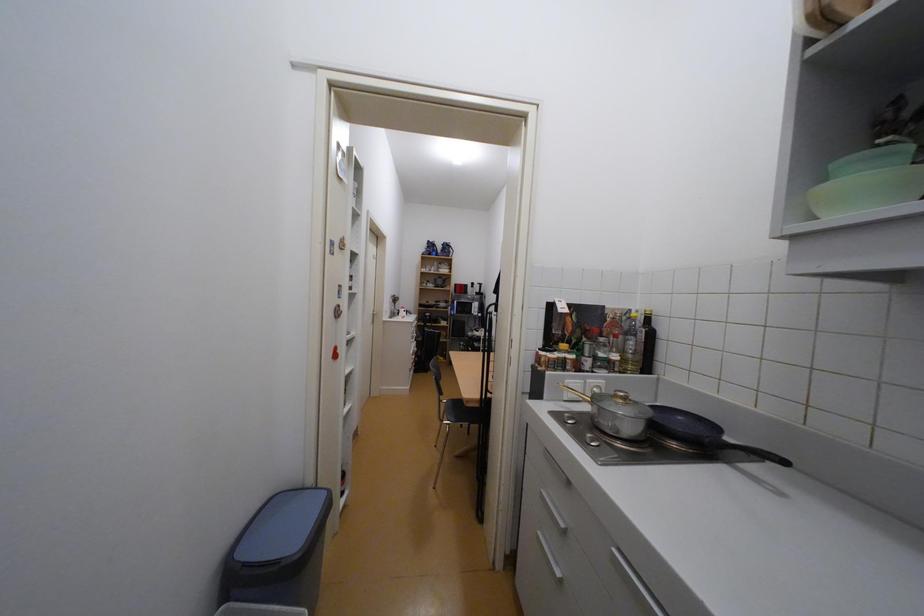
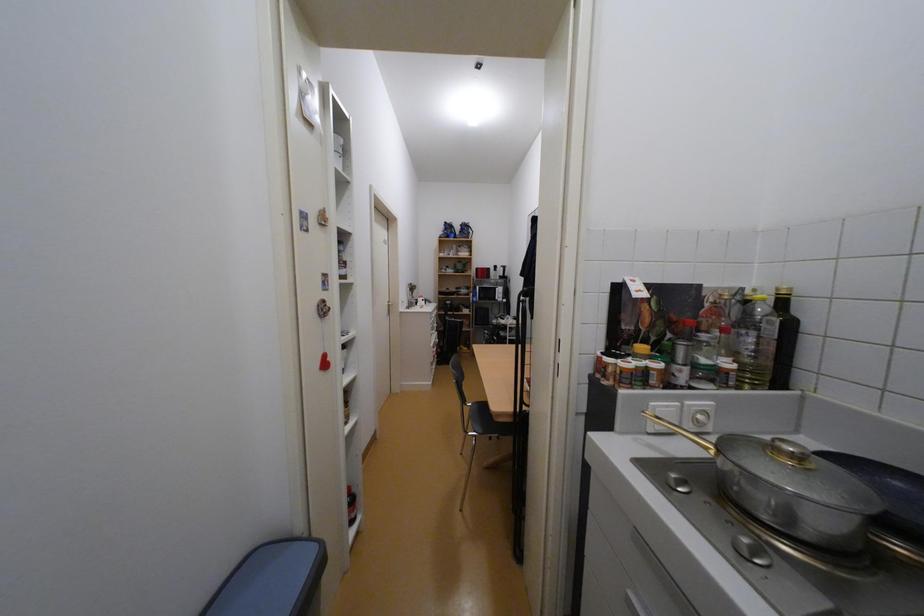
Question: The camera is either moving clockwise (left) or counter-clockwise (right) around the object. The first image is from the beginning of the video and the second image is from the end. Is the camera moving left or right when shooting the video?

Choices:
 (A) Left
 (B) Right

Answer: (B)